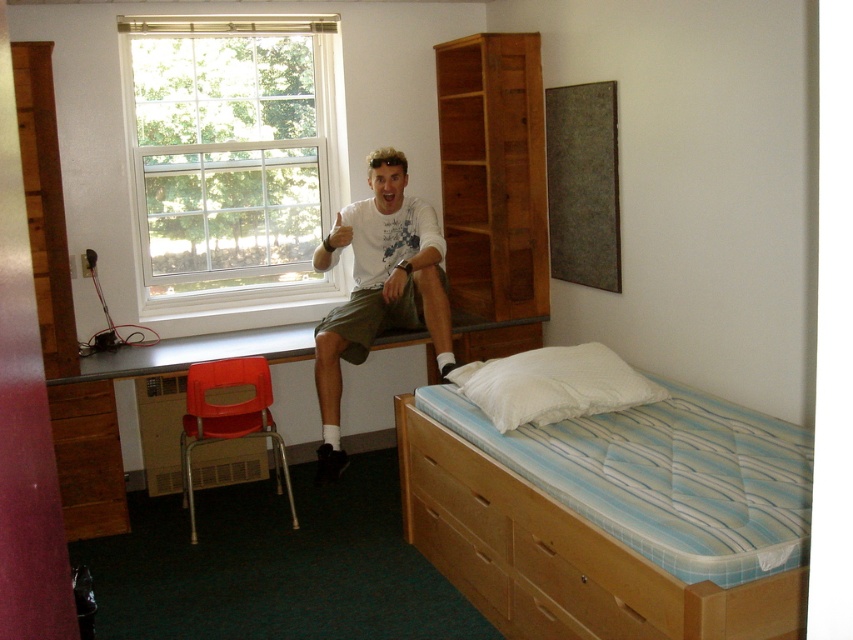
Looking at this image, who is positioned more to the left, white wood window at upper left or white soft pillow at lower right?

From the viewer's perspective, white wood window at upper left appears more on the left side.

Does white wood window at upper left appear on the right side of white soft pillow at lower right?

In fact, white wood window at upper left is to the left of white soft pillow at lower right.

What are the coordinates of `white wood window at upper left` in the screenshot? It's located at (230, 156).

Which is more to the left, light blue striped mattress at lower right or white cotton shirt at upper center?

Positioned to the left is white cotton shirt at upper center.

Who is more forward, [668,616] or [328,316]?

Point [668,616]

Image resolution: width=853 pixels, height=640 pixels. In order to click on light blue striped mattress at lower right in this screenshot , I will do `click(608, 506)`.

Identify the location of light blue striped mattress at lower right. The image size is (853, 640). (608, 506).

In the scene shown: Does light blue striped mattress at lower right have a smaller size compared to white soft pillow at lower right?

Actually, light blue striped mattress at lower right might be larger than white soft pillow at lower right.

Between light blue striped mattress at lower right and white soft pillow at lower right, which one is positioned higher?

white soft pillow at lower right is higher up.

Where is `light blue striped mattress at lower right`? This screenshot has height=640, width=853. light blue striped mattress at lower right is located at coordinates (608, 506).